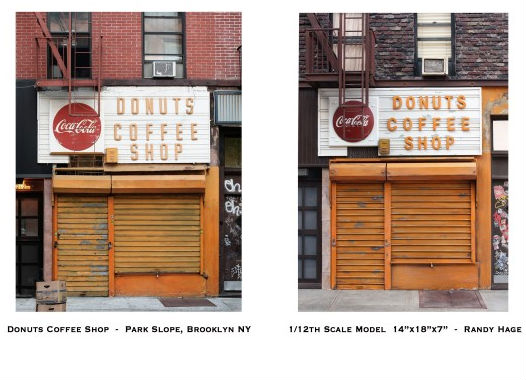
Where is `ladder`? This screenshot has width=526, height=380. ladder is located at coordinates (x=350, y=107).